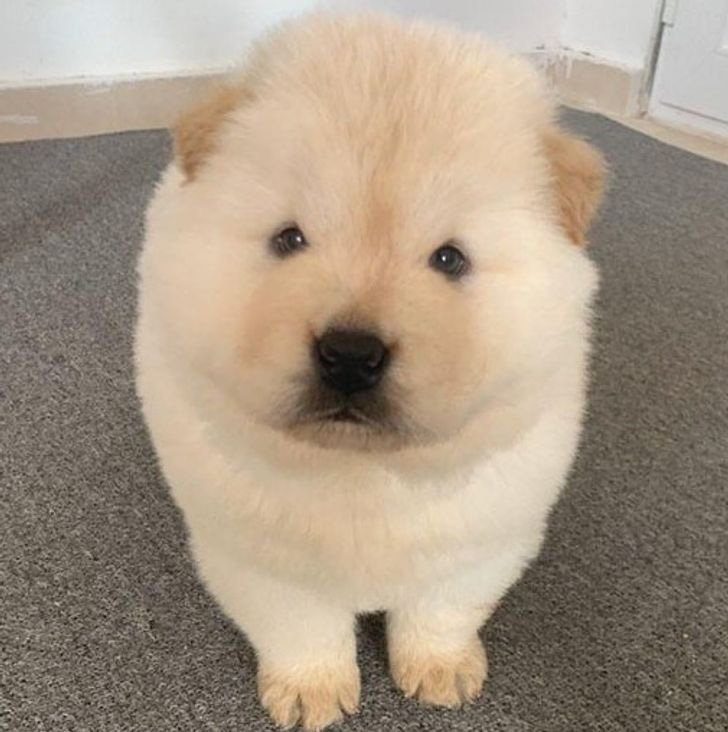
Find the location of a particular element. white door is located at coordinates (708, 75).